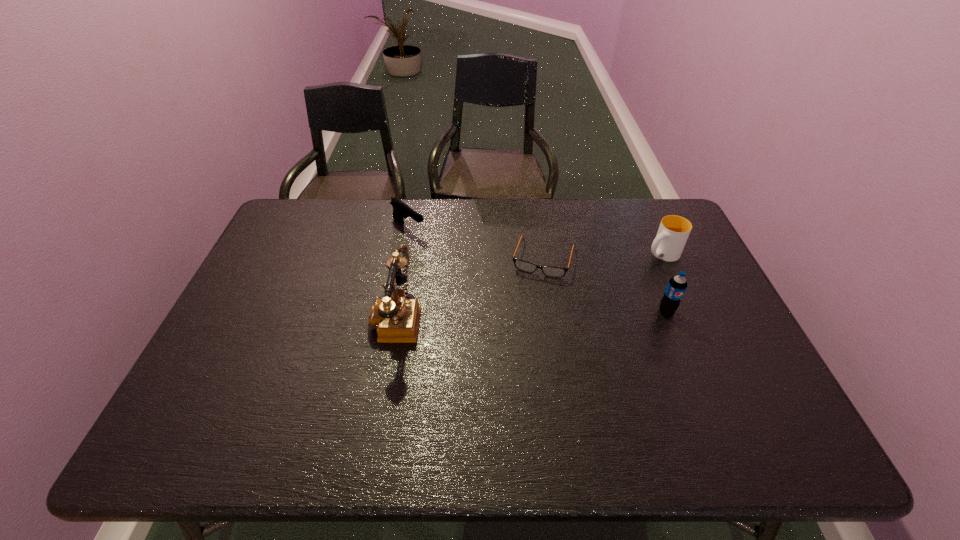
This screenshot has height=540, width=960. In order to click on object that is the second closest to the shortest object in this screenshot , I will do `click(677, 285)`.

Select which object is the third closest to the soda bottle. Please provide its 2D coordinates. Your answer should be formatted as a tuple, i.e. [(x, y)], where the tuple contains the x and y coordinates of a point satisfying the conditions above.

[(397, 318)]

The image size is (960, 540). I want to click on vacant area that satisfies the following two spatial constraints: 1. on the front side of the soda bottle; 2. on the right side of the spectacles, so click(x=552, y=312).

Find the location of a particular element. This screenshot has width=960, height=540. free spot that satisfies the following two spatial constraints: 1. on the front side of the second shortest object; 2. on the dial number of the telephone is located at coordinates (392, 316).

Locate an element on the screen. The height and width of the screenshot is (540, 960). blank space that satisfies the following two spatial constraints: 1. on the front side of the telephone; 2. on the dial number of the pistol is located at coordinates (392, 316).